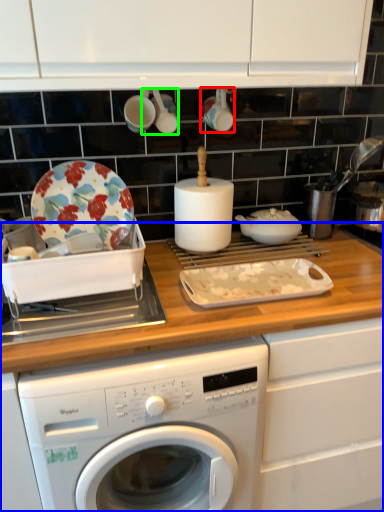
Question: Which object is the farthest from tableware (highlighted by a red box)? Choose among these: countertop (highlighted by a blue box) or tableware (highlighted by a green box).

Choices:
 (A) countertop
 (B) tableware

Answer: (A)